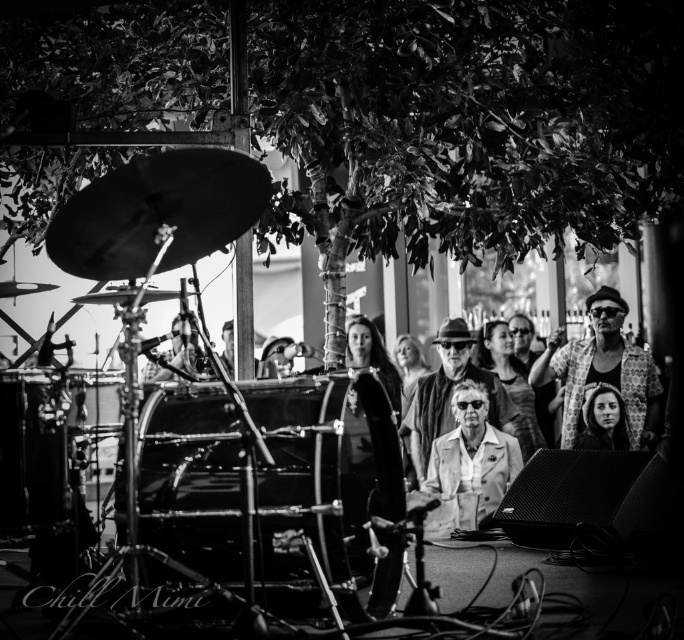
Question: Does shiny black drum at center appear over light beige leather jacket at center?

Choices:
 (A) yes
 (B) no

Answer: (A)

Question: Is shiny metallic drum at lower left wider than smooth skin face at lower center?

Choices:
 (A) yes
 (B) no

Answer: (B)

Question: Which point is farther from the camera taking this photo?

Choices:
 (A) (265, 506)
 (B) (10, 432)
 (C) (482, 406)

Answer: (C)

Question: Estimate the real-world distances between objects in this image. Which object is closer to the matte beige coat at center?

Choices:
 (A) shiny black drum at center
 (B) light beige leather jacket at center
 (C) smooth skin face at lower center
 (D) patterned fabric jacket at center

Answer: (C)

Question: Which point is farther from the camera taking this photo?

Choices:
 (A) (598, 410)
 (B) (499, 486)
 (C) (198, 481)
 (D) (451, 384)

Answer: (D)

Question: Can you confirm if patterned fabric jacket at center is positioned below matte beige coat at center?

Choices:
 (A) yes
 (B) no

Answer: (B)